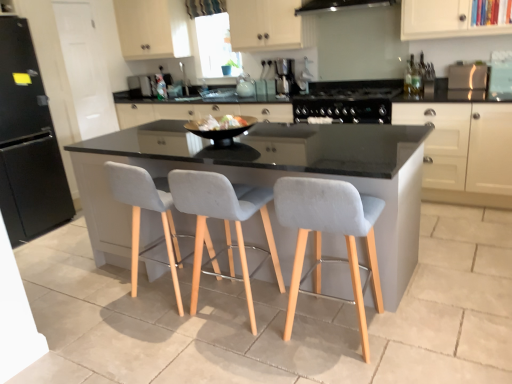
Question: Is black glass range hood at upper center facing towards light gray fabric chair at center, which appears as the 1th chair when viewed from the left?

Choices:
 (A) yes
 (B) no

Answer: (B)

Question: Does black glass range hood at upper center have a lesser width compared to light gray fabric chair at center, which appears as the 1th chair when viewed from the left?

Choices:
 (A) yes
 (B) no

Answer: (B)

Question: From the image's perspective, would you say black glass range hood at upper center is shown under light gray fabric chair at center, which appears as the 1th chair when viewed from the left?

Choices:
 (A) yes
 (B) no

Answer: (B)

Question: Does black glass range hood at upper center have a larger size compared to light gray fabric chair at center, which appears as the 1th chair when viewed from the left?

Choices:
 (A) yes
 (B) no

Answer: (B)

Question: From the image's perspective, is black glass range hood at upper center on light gray fabric chair at center, which appears as the 1th chair when viewed from the left?

Choices:
 (A) yes
 (B) no

Answer: (A)

Question: Is black glossy bowl at center, which ranks as the third appliance in left-to-right order, situated inside matte glass teapot at center, marked as the second appliance in a back-to-front arrangement, or outside?

Choices:
 (A) inside
 (B) outside

Answer: (B)

Question: Is black glossy bowl at center, which ranks as the third appliance in left-to-right order, taller or shorter than matte glass teapot at center, arranged as the second appliance when viewed from the right?

Choices:
 (A) tall
 (B) short

Answer: (B)

Question: Considering their positions, is black glossy bowl at center, which appears as the third appliance when viewed from the right, located in front of or behind matte glass teapot at center, the fourth appliance in the front-to-back sequence?

Choices:
 (A) behind
 (B) front

Answer: (B)

Question: Is point (243, 124) positioned closer to the camera than point (249, 94)?

Choices:
 (A) closer
 (B) farther

Answer: (A)

Question: In terms of width, does light gray fabric chair at center, the 2th chair in the left-to-right sequence, look wider or thinner when compared to black glass range hood at upper center?

Choices:
 (A) thin
 (B) wide

Answer: (A)

Question: Which is correct: light gray fabric chair at center, which ranks as the second chair in right-to-left order, is inside black glass range hood at upper center, or outside of it?

Choices:
 (A) outside
 (B) inside

Answer: (A)

Question: From the image's perspective, is light gray fabric chair at center, the 2th chair in the left-to-right sequence, above or below black glass range hood at upper center?

Choices:
 (A) below
 (B) above

Answer: (A)

Question: From a real-world perspective, is light gray fabric chair at center, which ranks as the second chair in right-to-left order, positioned above or below black glass range hood at upper center?

Choices:
 (A) below
 (B) above

Answer: (A)

Question: Is light gray fabric chair at center, the 3th chair when ordered from right to left, taller or shorter than light gray fabric chair at center, which is counted as the first chair, starting from the right?

Choices:
 (A) tall
 (B) short

Answer: (A)

Question: Would you say light gray fabric chair at center, which appears as the 1th chair when viewed from the left, is inside or outside light gray fabric chair at center, which is counted as the first chair, starting from the right?

Choices:
 (A) inside
 (B) outside

Answer: (B)